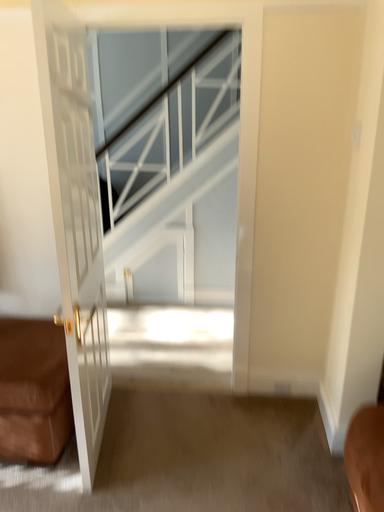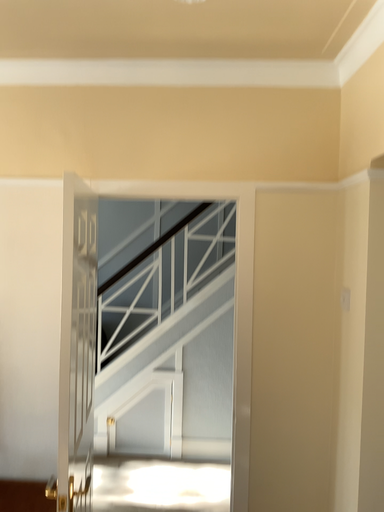
Question: How did the camera likely rotate when shooting the video?

Choices:
 (A) rotated downward
 (B) rotated upward

Answer: (B)